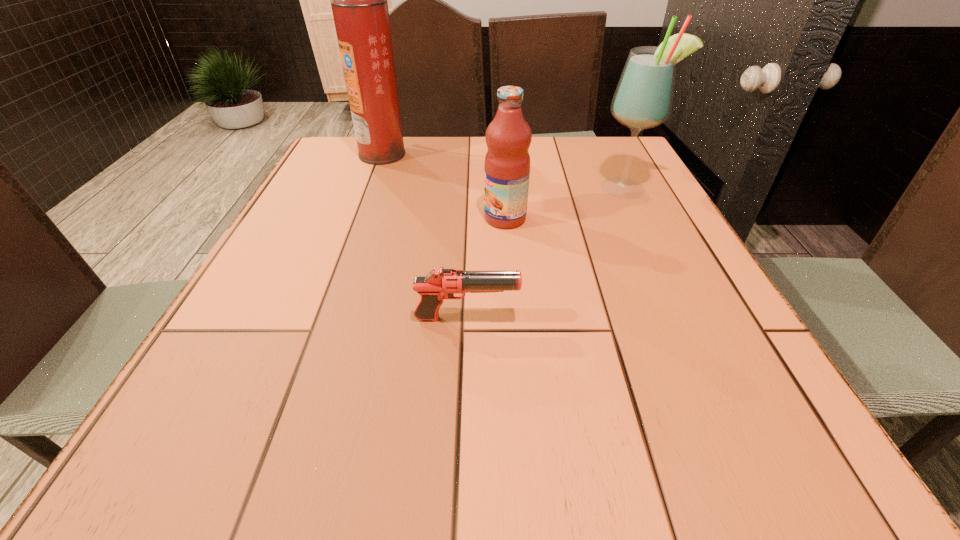
Locate an element on the screen. This screenshot has height=540, width=960. vacant space situated on the front label of the second nearest object is located at coordinates (387, 218).

Image resolution: width=960 pixels, height=540 pixels. Identify the location of vacant region located 0.140m on the front label of the second nearest object. (424, 218).

This screenshot has height=540, width=960. What are the coordinates of `vacant space located on the front label of the second nearest object` in the screenshot? It's located at (340, 218).

The image size is (960, 540). I want to click on free space located at the aiming end of the nearest object, so click(645, 319).

Locate an element on the screen. object at the far edge is located at coordinates (359, 0).

In order to click on object that is at the left edge in this screenshot , I will do `click(359, 0)`.

Locate an element on the screen. object present at the right edge is located at coordinates (643, 99).

In order to click on object at the far left corner in this screenshot , I will do click(359, 0).

Where is `vacant space at the near edge of the desktop`? Image resolution: width=960 pixels, height=540 pixels. vacant space at the near edge of the desktop is located at coordinates (291, 450).

Locate an element on the screen. The height and width of the screenshot is (540, 960). vacant space at the left edge is located at coordinates (229, 310).